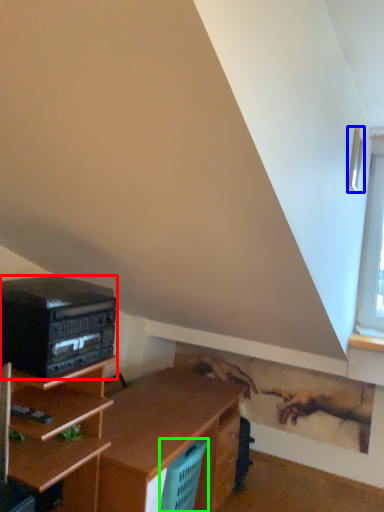
Question: Which is farther away from stereo (highlighted by a red box)? window (highlighted by a blue box) or basket (highlighted by a green box)?

Choices:
 (A) window
 (B) basket

Answer: (A)